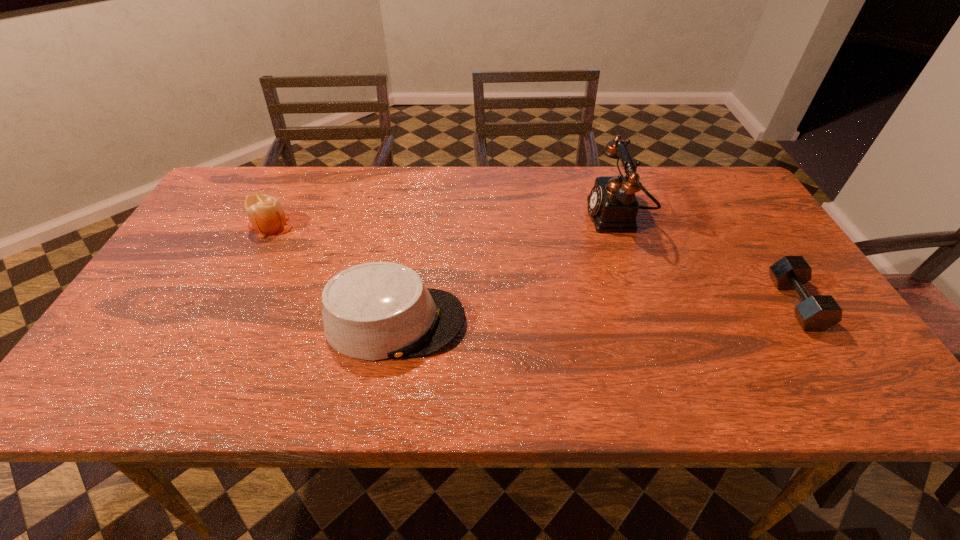
Locate an element on the screen. Image resolution: width=960 pixels, height=540 pixels. vacant space at the far left corner of the desktop is located at coordinates (235, 210).

In the image, there is a desktop. Where is `free region at the near left corner`? The image size is (960, 540). free region at the near left corner is located at coordinates (132, 392).

In the image, there is a desktop. Identify the location of free region at the far right corner. This screenshot has height=540, width=960. (736, 206).

Image resolution: width=960 pixels, height=540 pixels. What are the coordinates of `empty space between the rightmost object and the second object from right to left` in the screenshot? It's located at (706, 260).

Where is `vacant area between the hat and the candle`? vacant area between the hat and the candle is located at coordinates (333, 274).

The height and width of the screenshot is (540, 960). I want to click on free point between the third object from left to right and the shortest object, so click(x=706, y=260).

Image resolution: width=960 pixels, height=540 pixels. Find the location of `free spot between the candle and the dumbbell`. free spot between the candle and the dumbbell is located at coordinates tap(533, 264).

Identify the location of vacant area that lies between the telephone and the dumbbell. The image size is (960, 540). (706, 260).

This screenshot has height=540, width=960. In order to click on empty location between the candle and the rightmost object in this screenshot , I will do `click(533, 264)`.

You are a GUI agent. You are given a task and a screenshot of the screen. Output one action in this format:
    pyautogui.click(x=<x>, y=<y>)
    Task: Click on the vacant space that is in between the leftmost object and the tallest object
    
    Given the screenshot: What is the action you would take?
    [444, 221]